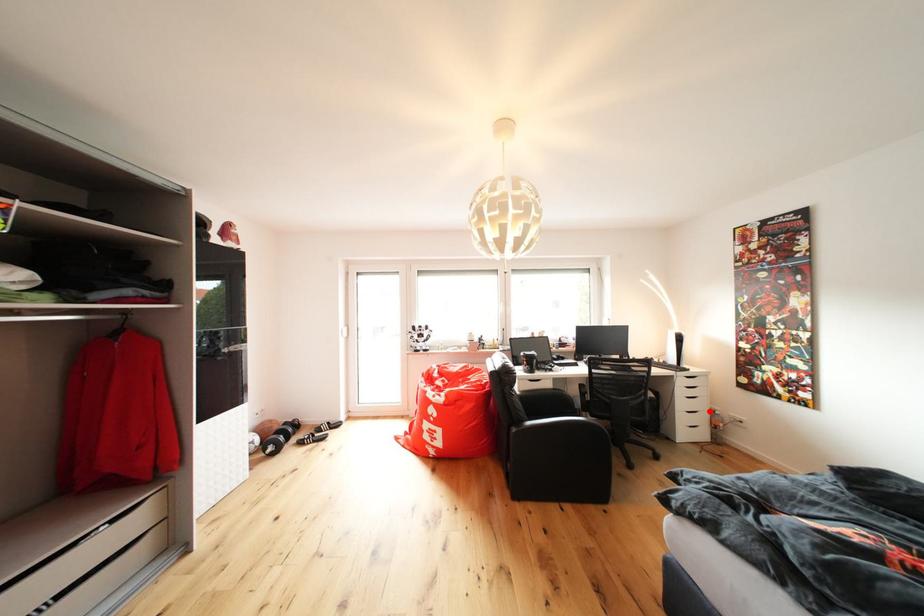
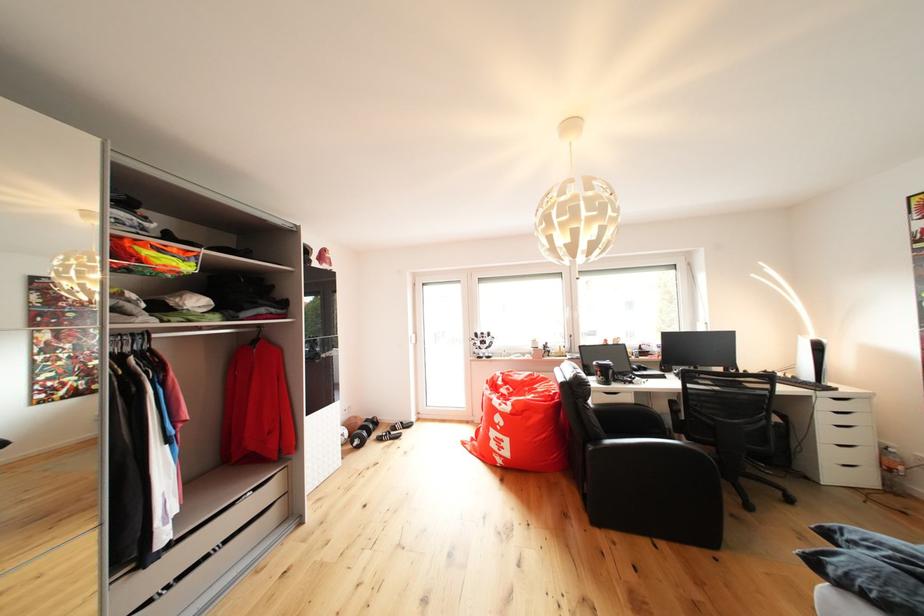
Question: I am providing you with two images of the same scene from different viewpoints. Image1 has a red point marked. In image2, the corresponding 3D location appears at what relative position? Reply with the corresponding letter.

Choices:
 (A) Closer
 (B) Farther

Answer: (B)